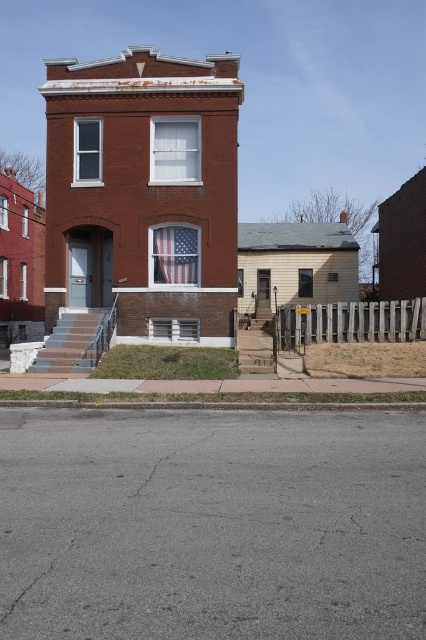
Question: Does gray concrete curb at lower center appear on the right side of american flag at center?

Choices:
 (A) no
 (B) yes

Answer: (B)

Question: Which of the following is the closest to the observer?

Choices:
 (A) (172, 236)
 (B) (37, 401)

Answer: (B)

Question: Can you confirm if gray concrete curb at lower center is positioned to the right of american flag at center?

Choices:
 (A) no
 (B) yes

Answer: (B)

Question: Among these objects, which one is nearest to the camera?

Choices:
 (A) gray concrete curb at lower center
 (B) american flag at center

Answer: (A)

Question: Does gray concrete curb at lower center appear on the right side of american flag at center?

Choices:
 (A) no
 (B) yes

Answer: (B)

Question: Which of the following is the farthest from the observer?

Choices:
 (A) (187, 264)
 (B) (385, 403)

Answer: (A)